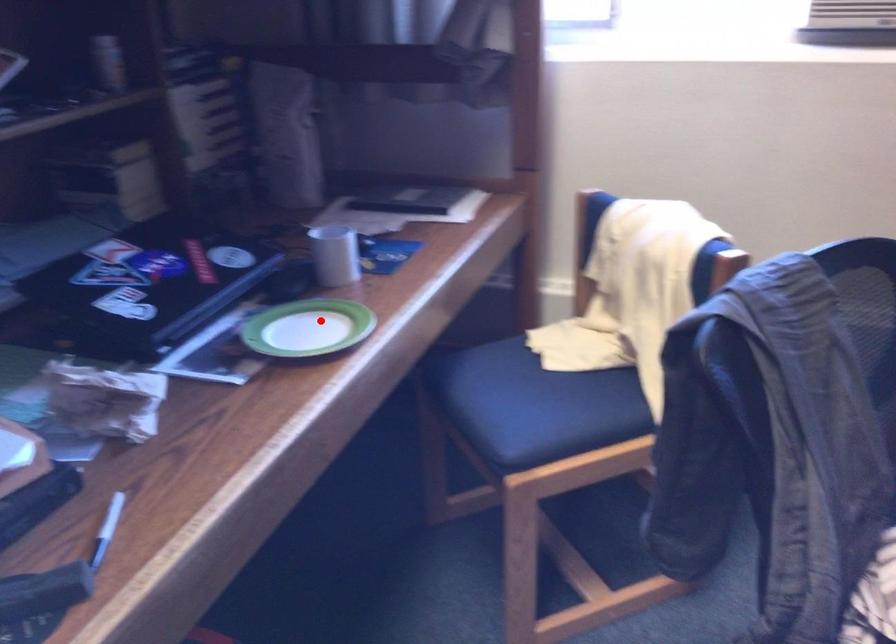
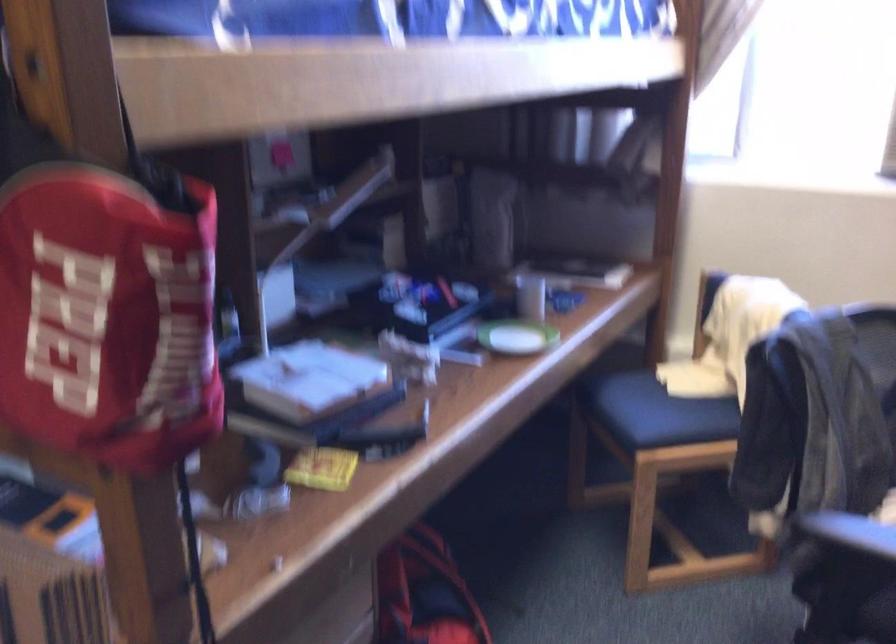
Question: I am providing you with two images of the same scene from different viewpoints. Given a red point in image1, look at the same physical point in image2. Is it:

Choices:
 (A) Closer to the viewpoint
 (B) Farther from the viewpoint

Answer: (B)